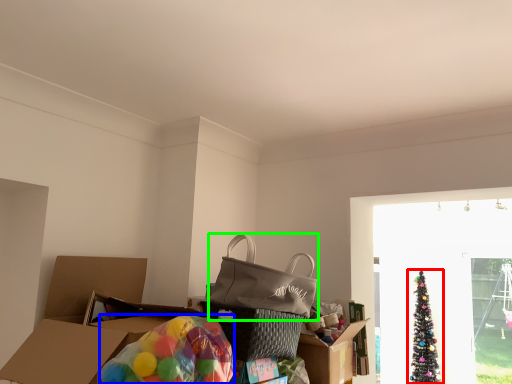
Question: Based on their relative distances, which object is farther from christmas tree (highlighted by a red box)? Choose from balloon (highlighted by a blue box) and pack (highlighted by a green box).

Choices:
 (A) balloon
 (B) pack

Answer: (A)